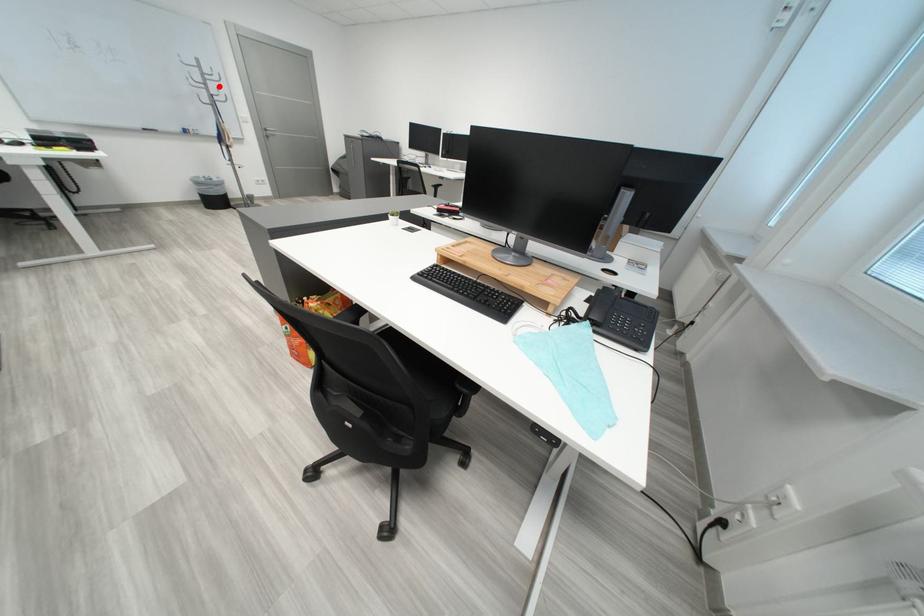
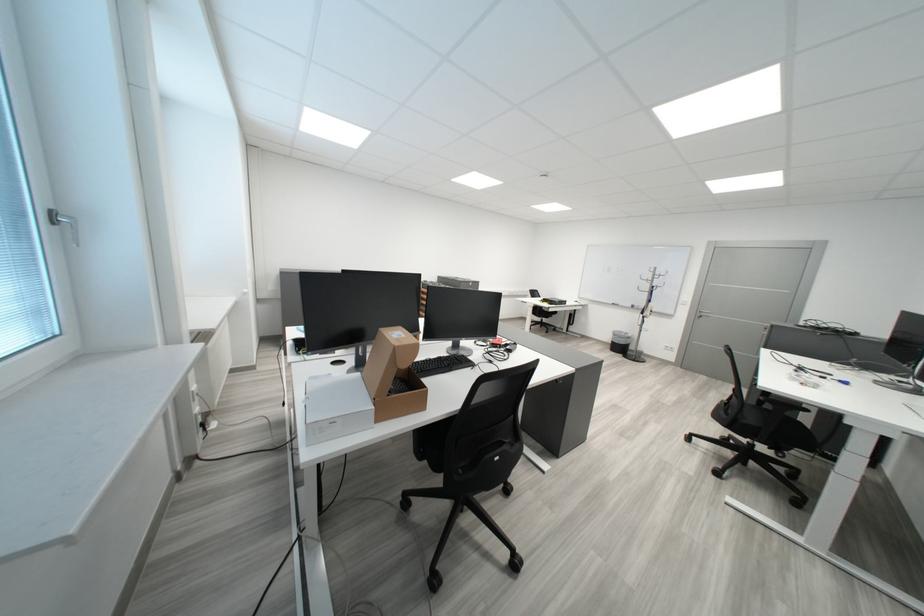
Locate, in the second image, the point that corresponds to the highlighted location in the first image.

(665, 283)